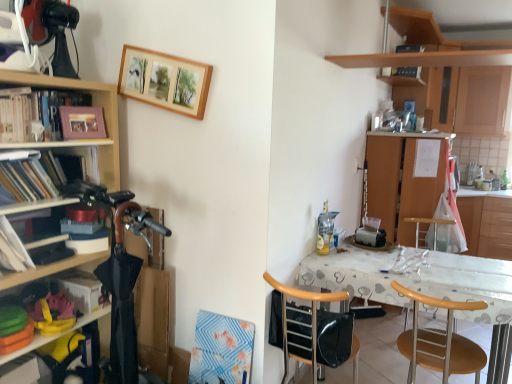
Measure the distance between point (409, 358) and camera.

Point (409, 358) is 2.12 meters away from camera.

The height and width of the screenshot is (384, 512). What do you see at coordinates (12, 249) in the screenshot? I see `white paper at left, the 2th book positioned from the bottom` at bounding box center [12, 249].

This screenshot has height=384, width=512. What do you see at coordinates (461, 99) in the screenshot?
I see `wooden cabinet at upper right, which appears as the second cabinetry when viewed from the left` at bounding box center [461, 99].

Where is `wooden picture frame at upper center, the first picture frame positioned from the right`? The image size is (512, 384). wooden picture frame at upper center, the first picture frame positioned from the right is located at coordinates (164, 81).

You are a GUI agent. You are given a task and a screenshot of the screen. Output one action in this format:
    pyautogui.click(x=<x>, y=<y>)
    Task: Click on the matte wooden picture frame at upper left, which appears as the 2th picture frame when viewed from the right
    
    Given the screenshot: What is the action you would take?
    pyautogui.click(x=82, y=122)

The width and height of the screenshot is (512, 384). I want to click on rubber yellow shoes at lower left, positioned as the 1th shelf in bottom-to-top order, so click(x=55, y=335).

Looking at this image, is wooden bookshelf at left facing away from matte black book at left, which is the 1th book in back-to-front order?

Yes, wooden bookshelf at left's orientation is away from matte black book at left, which is the 1th book in back-to-front order.

Who is bigger, wooden bookshelf at left or matte black book at left, which is the 1th book in back-to-front order?

With larger size is wooden bookshelf at left.

Who is taller, wooden bookshelf at left or matte black book at left, positioned as the second book in top-to-bottom order?

wooden bookshelf at left.

How many degrees apart are the facing directions of rubber yellow shoes at lower left, the third shelf from the top, and wooden cabinet at right, the first cabinetry viewed from the left?

The angular difference between rubber yellow shoes at lower left, the third shelf from the top, and wooden cabinet at right, the first cabinetry viewed from the left, is 2.99 degrees.

Can you confirm if rubber yellow shoes at lower left, positioned as the 1th shelf in bottom-to-top order, is smaller than wooden cabinet at right, acting as the 3th cabinetry starting from the right?

Correct, rubber yellow shoes at lower left, positioned as the 1th shelf in bottom-to-top order, occupies less space than wooden cabinet at right, acting as the 3th cabinetry starting from the right.

Is rubber yellow shoes at lower left, the third shelf from the top, wider or thinner than wooden cabinet at right, the first cabinetry viewed from the left?

Considering their sizes, rubber yellow shoes at lower left, the third shelf from the top, looks slimmer than wooden cabinet at right, the first cabinetry viewed from the left.

The height and width of the screenshot is (384, 512). I want to click on the 2nd cabinetry below the wooden picture frame at upper center, the first picture frame positioned from the right (from a real-world perspective), so click(x=487, y=226).

Is wooden cabinet at right, the 1th cabinetry from the right, oriented towards wooden picture frame at upper center, the first picture frame positioned from the right?

No, wooden cabinet at right, the 1th cabinetry from the right, is not oriented towards wooden picture frame at upper center, the first picture frame positioned from the right.

Between wooden cabinet at right, the 1th cabinetry from the right, and wooden picture frame at upper center, the first picture frame positioned from the right, which one has smaller width?

Thinner between the two is wooden picture frame at upper center, the first picture frame positioned from the right.

Are wooden cabinet at right, acting as the third cabinetry starting from the left, and wooden picture frame at upper center, positioned as the second picture frame in bottom-to-top order, far apart?

Absolutely, wooden cabinet at right, acting as the third cabinetry starting from the left, is distant from wooden picture frame at upper center, positioned as the second picture frame in bottom-to-top order.

Is black leather chair at center, the 1th chair from the left, inside or outside of wooden bar stool at center?

black leather chair at center, the 1th chair from the left, is not enclosed by wooden bar stool at center.

From a real-world perspective, is black leather chair at center, placed as the second chair when sorted from right to left, under wooden bar stool at center?

No, from a real-world perspective, black leather chair at center, placed as the second chair when sorted from right to left, is not beneath wooden bar stool at center.

Between black leather chair at center, placed as the second chair when sorted from right to left, and wooden bar stool at center, which one has larger width?

wooden bar stool at center is wider.

What's the angular difference between wooden bookshelf at left, arranged as the second shelf when ordered from the bottom, and matte black book at left, which is the 1th book in back-to-front order,'s facing directions?

The facing directions of wooden bookshelf at left, arranged as the second shelf when ordered from the bottom, and matte black book at left, which is the 1th book in back-to-front order, are 0.000208 degrees apart.

Looking at this image, does wooden bookshelf at left, the second shelf positioned from the top, have a lesser height compared to matte black book at left, the second book when ordered from front to back?

No, wooden bookshelf at left, the second shelf positioned from the top, is not shorter than matte black book at left, the second book when ordered from front to back.

Which point is more distant from viewer, (31, 184) or (73, 287)?

The point (73, 287) is more distant.

Does wooden bookshelf at left, arranged as the second shelf when ordered from the bottom, turn towards matte black book at left, which is the 1th book in back-to-front order?

No, wooden bookshelf at left, arranged as the second shelf when ordered from the bottom, is not turned towards matte black book at left, which is the 1th book in back-to-front order.

Looking at their sizes, would you say matte wooden picture frame at upper left, which appears as the 2th picture frame when viewed from the right, is wider or thinner than wooden bookshelf at left?

In the image, matte wooden picture frame at upper left, which appears as the 2th picture frame when viewed from the right, appears to be more narrow than wooden bookshelf at left.

The width and height of the screenshot is (512, 384). In the image, there is a matte wooden picture frame at upper left, which appears as the first picture frame when ordered from the bottom. In order to click on cupboard below it (from a real-world perspective) in this screenshot , I will do `click(93, 105)`.

Is matte wooden picture frame at upper left, which appears as the first picture frame when ordered from the bottom, smaller than wooden bookshelf at left?

Yes, matte wooden picture frame at upper left, which appears as the first picture frame when ordered from the bottom, is smaller than wooden bookshelf at left.

Which object is positioned more to the left, matte wooden picture frame at upper left, the 1th picture frame when ordered from left to right, or wooden bookshelf at left?

wooden bookshelf at left.

From a real-world perspective, between black leather chair at center, the 1th chair from the left, and wooden cabinet at upper right, which appears as the second cabinetry when viewed from the left, who is vertically lower?

In real-world perspective, black leather chair at center, the 1th chair from the left, is lower.

In terms of width, does black leather chair at center, the 1th chair from the left, look wider or thinner when compared to wooden cabinet at upper right, which appears as the second cabinetry when viewed from the left?

Considering their sizes, black leather chair at center, the 1th chair from the left, looks slimmer than wooden cabinet at upper right, which appears as the second cabinetry when viewed from the left.

The height and width of the screenshot is (384, 512). There is a wooden cabinet at upper right, which appears as the second cabinetry when viewed from the left. What are the coordinates of `the 1st chair below it (from a real-world perspective)` in the screenshot? It's located at (301, 325).

At what (x,y) coordinates should I click in order to perform the action: click on cupboard on the left of matte black book at left, positioned as the second book in top-to-bottom order. Please return your answer as a coordinate pair (x, y). The height and width of the screenshot is (384, 512). Looking at the image, I should click on (93, 105).

Identify the location of shelf beneath the wooden cabinet at right, the first cabinetry viewed from the left (from a real-world perspective). (55, 335).

In the scene shown: Estimate the real-world distances between objects in this image. Which object is closer to wooden bookshelf at left, arranged as the 1th shelf when viewed from the top, matte wooden picture frame at upper left, the second picture frame in the top-to-bottom sequence, or wooden cabinet at upper right, which appears as the second cabinetry when viewed from the left?

Based on the image, matte wooden picture frame at upper left, the second picture frame in the top-to-bottom sequence, appears to be nearer to wooden bookshelf at left, arranged as the 1th shelf when viewed from the top.

Based on their spatial positions, is wooden cabinet at right, acting as the third cabinetry starting from the left, or wooden picture frame at upper center, the 2th picture frame positioned from the left, closer to matte black book at left, positioned as the second book in top-to-bottom order?

Among the two, wooden picture frame at upper center, the 2th picture frame positioned from the left, is located nearer to matte black book at left, positioned as the second book in top-to-bottom order.

From the image, which object appears to be nearer to wooden bookshelf at left, arranged as the 1th shelf when viewed from the top, wooden bar stool at center or matte black book at left, the second book when ordered from front to back?

The object closer to wooden bookshelf at left, arranged as the 1th shelf when viewed from the top, is matte black book at left, the second book when ordered from front to back.

Which object lies nearer to the anchor point wooden bookshelf at left, the third shelf when ordered from bottom to top, wooden cabinet at upper right, the 2th cabinetry in the right-to-left sequence, or wooden picture frame at upper center, positioned as the second picture frame in bottom-to-top order?

Among the two, wooden picture frame at upper center, positioned as the second picture frame in bottom-to-top order, is located nearer to wooden bookshelf at left, the third shelf when ordered from bottom to top.

Considering their positions, is wooden bookshelf at left, the second shelf positioned from the top, positioned further to white paper at left, the first book viewed from the front, than wooden cabinet at right, acting as the 3th cabinetry starting from the right?

wooden cabinet at right, acting as the 3th cabinetry starting from the right, is positioned further to the anchor white paper at left, the first book viewed from the front.

Estimate the real-world distances between objects in this image. Which object is further from matte wooden picture frame at upper left, which appears as the 2th picture frame when viewed from the right, wooden picture frame at upper center, which is the 1th picture frame in top-to-bottom order, or wooden cabinet at right, acting as the third cabinetry starting from the left?

wooden cabinet at right, acting as the third cabinetry starting from the left, is positioned further to the anchor matte wooden picture frame at upper left, which appears as the 2th picture frame when viewed from the right.

Considering their positions, is wooden bookshelf at left, arranged as the 1th shelf when viewed from the top, positioned further to wooden bar stool at center than wooden cabinet at right, acting as the 3th cabinetry starting from the right?

wooden bookshelf at left, arranged as the 1th shelf when viewed from the top, is positioned further to the anchor wooden bar stool at center.

Estimate the real-world distances between objects in this image. Which object is further from matte black book at left, which is the 1th book in back-to-front order, wooden cabinet at right, the first cabinetry viewed from the left, or wooden cabinet at right, the 1th cabinetry from the right?

Among the two, wooden cabinet at right, the 1th cabinetry from the right, is located further to matte black book at left, which is the 1th book in back-to-front order.

At what (x,y) coordinates should I click in order to perform the action: click on cupboard between wooden picture frame at upper center, the first picture frame positioned from the right, and rubber yellow shoes at lower left, the third shelf from the top, in the up-down direction. Please return your answer as a coordinate pair (x, y). Looking at the image, I should click on (93, 105).

The height and width of the screenshot is (384, 512). In order to click on book between wooden bookshelf at left, arranged as the second shelf when ordered from the bottom, and wooden at right, the first chair in the right-to-left sequence in this screenshot , I will do `click(80, 289)`.

The width and height of the screenshot is (512, 384). What are the coordinates of `chair positioned between wooden at right, the second chair when ordered from left to right, and wooden bar stool at center from near to far` in the screenshot? It's located at (301, 325).

Where is `bar stool between black leather chair at center, the 1th chair from the left, and wooden cabinet at right, the 1th cabinetry from the right, from front to back`? The height and width of the screenshot is (384, 512). bar stool between black leather chair at center, the 1th chair from the left, and wooden cabinet at right, the 1th cabinetry from the right, from front to back is located at coordinates (429, 222).